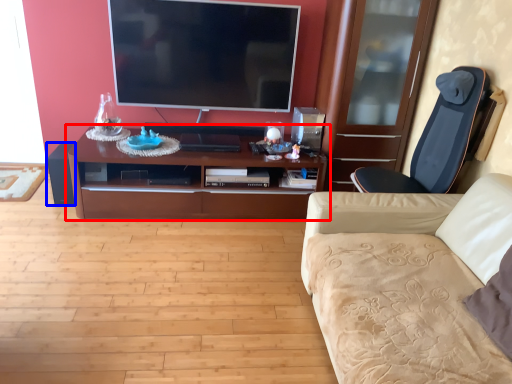
Question: Which object appears closest to the camera in this image, cabinetry (highlighted by a red box) or speaker (highlighted by a blue box)?

Choices:
 (A) cabinetry
 (B) speaker

Answer: (A)